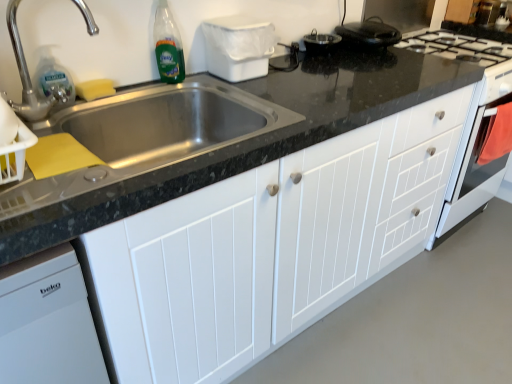
The width and height of the screenshot is (512, 384). Describe the element at coordinates (52, 78) in the screenshot. I see `clear plastic bottle at sink left` at that location.

Where is `green glass bottle at upper left`? green glass bottle at upper left is located at coordinates (168, 46).

Measure the distance between white wood cabinet at center and camera.

The depth of white wood cabinet at center is 32.13 inches.

In order to click on clear plastic bottle at sink left in this screenshot , I will do `click(52, 78)`.

Can you confirm if white wood cabinet at center is shorter than silver metallic faucet at upper left?

No.

Is white wood cabinet at center in front of silver metallic faucet at upper left?

Yes, white wood cabinet at center is in front of silver metallic faucet at upper left.

Would you say white wood cabinet at center contains silver metallic faucet at upper left?

No, white wood cabinet at center does not contain silver metallic faucet at upper left.

From the image's perspective, relative to silver metallic faucet at upper left, is white wood cabinet at center above or below?

white wood cabinet at center is situated lower than silver metallic faucet at upper left in the image.

Considering the relative sizes of green glass bottle at upper left and silver metallic faucet at upper left in the image provided, is green glass bottle at upper left shorter than silver metallic faucet at upper left?

Yes, green glass bottle at upper left is shorter than silver metallic faucet at upper left.

From a real-world perspective, is green glass bottle at upper left physically below silver metallic faucet at upper left?

Yes, from a real-world perspective, green glass bottle at upper left is below silver metallic faucet at upper left.

Which is less distant, (x=169, y=20) or (x=12, y=22)?

The point (x=12, y=22) is in front.

Is green glass bottle at upper left oriented away from silver metallic faucet at upper left?

No, silver metallic faucet at upper left is not at the back of green glass bottle at upper left.

Who is bigger, clear plastic bottle at sink left or silver metallic faucet at upper left?

Bigger between the two is silver metallic faucet at upper left.

Considering the relative positions of clear plastic bottle at sink left and silver metallic faucet at upper left in the image provided, is clear plastic bottle at sink left behind silver metallic faucet at upper left?

That is True.

Is point (61, 100) closer or farther from the camera than point (45, 99)?

Point (61, 100).

From a real-world perspective, between silver metallic faucet at upper left and green glass bottle at upper left, who is vertically lower?

green glass bottle at upper left, from a real-world perspective.

Looking at this image, which of these two, silver metallic faucet at upper left or green glass bottle at upper left, stands shorter?

green glass bottle at upper left.

Is point (15, 55) closer or farther from the camera than point (170, 76)?

Clearly, point (15, 55) is closer to the camera than point (170, 76).

From the image's perspective, is silver metallic faucet at upper left below green glass bottle at upper left?

Yes, from the image's perspective, silver metallic faucet at upper left is below green glass bottle at upper left.

Considering the relative sizes of silver metallic faucet at upper left and clear plastic bottle at sink left in the image provided, is silver metallic faucet at upper left smaller than clear plastic bottle at sink left?

Incorrect, silver metallic faucet at upper left is not smaller in size than clear plastic bottle at sink left.

Does silver metallic faucet at upper left contain clear plastic bottle at sink left?

Yes, silver metallic faucet at upper left contains clear plastic bottle at sink left.

How much distance is there between silver metallic faucet at upper left and clear plastic bottle at sink left?

A distance of 2.62 inches exists between silver metallic faucet at upper left and clear plastic bottle at sink left.

What's the angular difference between silver metallic faucet at upper left and clear plastic bottle at sink left's facing directions?

0.0015 degrees separate the facing orientations of silver metallic faucet at upper left and clear plastic bottle at sink left.

From the image's perspective, is clear plastic bottle at sink left under white wood cabinet at center?

Incorrect, from the image's perspective, clear plastic bottle at sink left is higher than white wood cabinet at center.

Where is `cleaning product lying behind the white wood cabinet at center`? Image resolution: width=512 pixels, height=384 pixels. cleaning product lying behind the white wood cabinet at center is located at coordinates (52, 78).

Does clear plastic bottle at sink left touch white wood cabinet at center?

clear plastic bottle at sink left is not next to white wood cabinet at center, and they're not touching.

Is clear plastic bottle at sink left not within white wood cabinet at center?

Yes, clear plastic bottle at sink left is located beyond the bounds of white wood cabinet at center.

From a real-world perspective, is green glass bottle at upper left beneath white wood cabinet at center?

Actually, green glass bottle at upper left is physically above white wood cabinet at center in the real world.

Locate an element on the screen. The image size is (512, 384). bottle that is on the left side of white wood cabinet at center is located at coordinates (168, 46).

Which is farther from the camera, (162, 73) or (445, 98)?

The point (445, 98) is behind.

Locate an element on the screen. This screenshot has width=512, height=384. cabinetry that is under the silver metallic faucet at upper left (from a real-world perspective) is located at coordinates (266, 249).

Where is `tap positioned vertically above the green glass bottle at upper left (from a real-world perspective)`? This screenshot has height=384, width=512. tap positioned vertically above the green glass bottle at upper left (from a real-world perspective) is located at coordinates (29, 77).

From the image, which object appears to be nearer to silver metallic faucet at upper left, clear plastic bottle at sink left or green glass bottle at upper left?

Based on the image, clear plastic bottle at sink left appears to be nearer to silver metallic faucet at upper left.

Looking at the image, which one is located further to green glass bottle at upper left, white wood cabinet at center or clear plastic bottle at sink left?

white wood cabinet at center is positioned further to the anchor green glass bottle at upper left.

When comparing their distances from silver metallic faucet at upper left, does white wood cabinet at center or green glass bottle at upper left seem further?

Among the two, white wood cabinet at center is located further to silver metallic faucet at upper left.

When comparing their distances from green glass bottle at upper left, does silver metallic faucet at upper left or clear plastic bottle at sink left seem further?

The object further to green glass bottle at upper left is silver metallic faucet at upper left.

When comparing their distances from clear plastic bottle at sink left, does silver metallic faucet at upper left or green glass bottle at upper left seem closer?

Among the two, silver metallic faucet at upper left is located nearer to clear plastic bottle at sink left.

Estimate the real-world distances between objects in this image. Which object is closer to white wood cabinet at center, clear plastic bottle at sink left or green glass bottle at upper left?

green glass bottle at upper left is closer to white wood cabinet at center.

Looking at this image, when comparing their distances from white wood cabinet at center, does silver metallic faucet at upper left or green glass bottle at upper left seem further?

silver metallic faucet at upper left lies further to white wood cabinet at center than the other object.

From the image, which object appears to be nearer to green glass bottle at upper left, clear plastic bottle at sink left or silver metallic faucet at upper left?

clear plastic bottle at sink left.

Find the location of `cleaning product positioned between silver metallic faucet at upper left and green glass bottle at upper left from near to far`. cleaning product positioned between silver metallic faucet at upper left and green glass bottle at upper left from near to far is located at coordinates (52, 78).

In order to click on bottle between clear plastic bottle at sink left and white wood cabinet at center in the horizontal direction in this screenshot , I will do `click(168, 46)`.

You are a GUI agent. You are given a task and a screenshot of the screen. Output one action in this format:
    pyautogui.click(x=<x>, y=<y>)
    Task: Click on the tap situated between clear plastic bottle at sink left and white wood cabinet at center from left to right
    The image size is (512, 384).
    Given the screenshot: What is the action you would take?
    pyautogui.click(x=29, y=77)

Identify the location of bottle between silver metallic faucet at upper left and white wood cabinet at center. The width and height of the screenshot is (512, 384). (x=168, y=46).